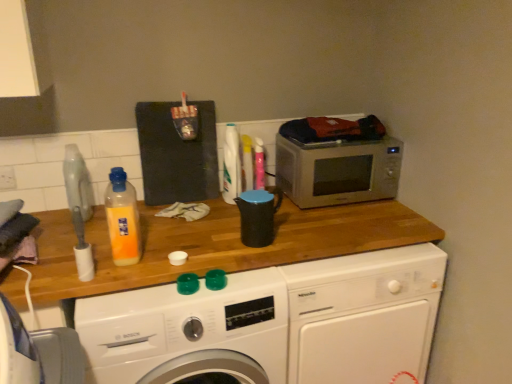
You are a GUI agent. You are given a task and a screenshot of the screen. Output one action in this format:
    pyautogui.click(x=<x>, y=<y>)
    Task: Click on the free space in front of translucent plastic bottle at center
    
    Given the screenshot: What is the action you would take?
    pyautogui.click(x=130, y=305)